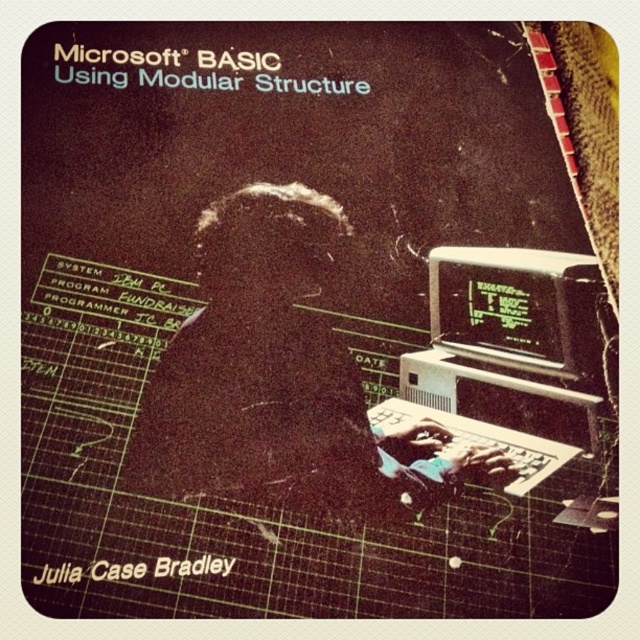
Does white plastic computer at center appear on the left side of black plastic monitor at right?

Indeed, white plastic computer at center is positioned on the left side of black plastic monitor at right.

Is point (492, 305) more distant than point (592, 298)?

Yes.

Identify the location of white plastic computer at center. (508, 356).